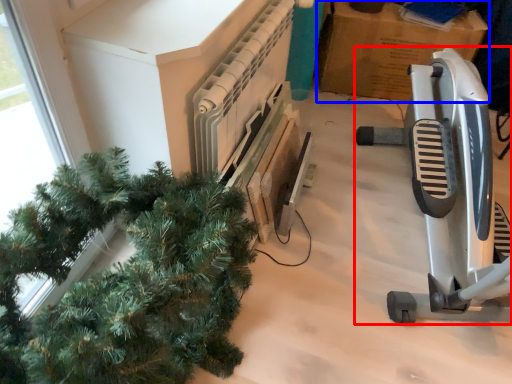
Question: Among these objects, which one is farthest to the camera, job (highlighted by a red box) or cardboard box (highlighted by a blue box)?

Choices:
 (A) job
 (B) cardboard box

Answer: (B)